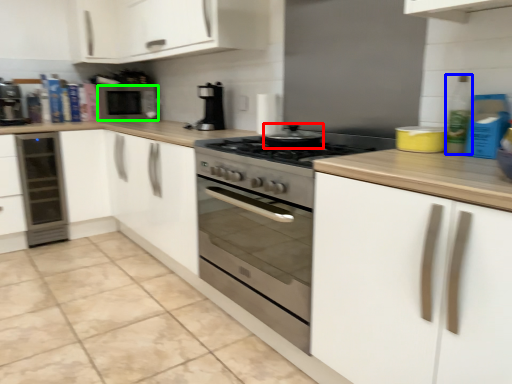
Question: Considering the real-world distances, which object is farthest from appliance (highlighted by a red box)? bottle (highlighted by a blue box) or microwave oven (highlighted by a green box)?

Choices:
 (A) bottle
 (B) microwave oven

Answer: (B)